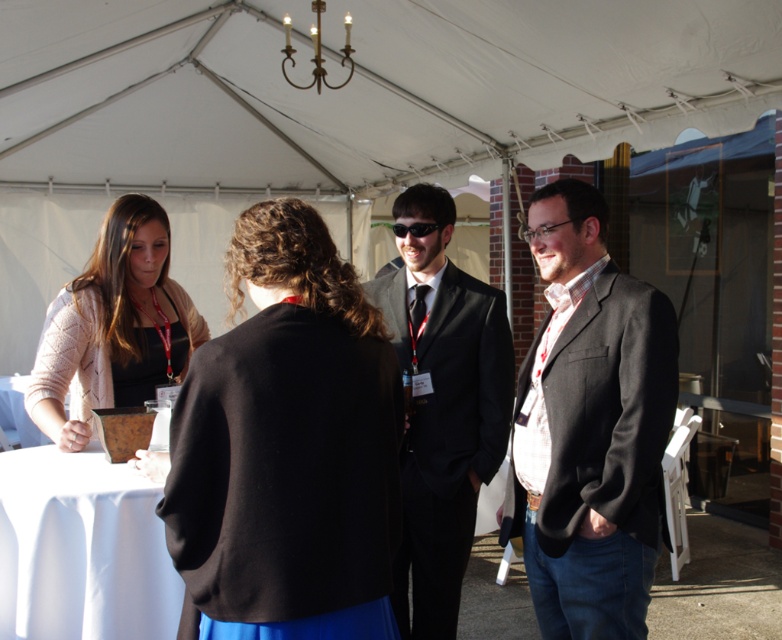
Question: Can you confirm if black wool coat at center is positioned above black suit at center?

Choices:
 (A) yes
 (B) no

Answer: (A)

Question: Which object appears closest to the camera in this image?

Choices:
 (A) matte black top at left
 (B) black suit at center
 (C) matte black suit at center

Answer: (C)

Question: Which point appears closest to the camera in this image?

Choices:
 (A) (396, 234)
 (B) (128, 220)
 (C) (633, 552)

Answer: (C)

Question: Estimate the real-world distances between objects in this image. Which object is closer to the matte black top at left?

Choices:
 (A) black suit at center
 (B) matte black suit at center

Answer: (A)

Question: Observing the image, what is the correct spatial positioning of black wool coat at center in reference to black suit at center?

Choices:
 (A) below
 (B) above

Answer: (B)

Question: Is black wool coat at center bigger than matte black suit at center?

Choices:
 (A) yes
 (B) no

Answer: (B)